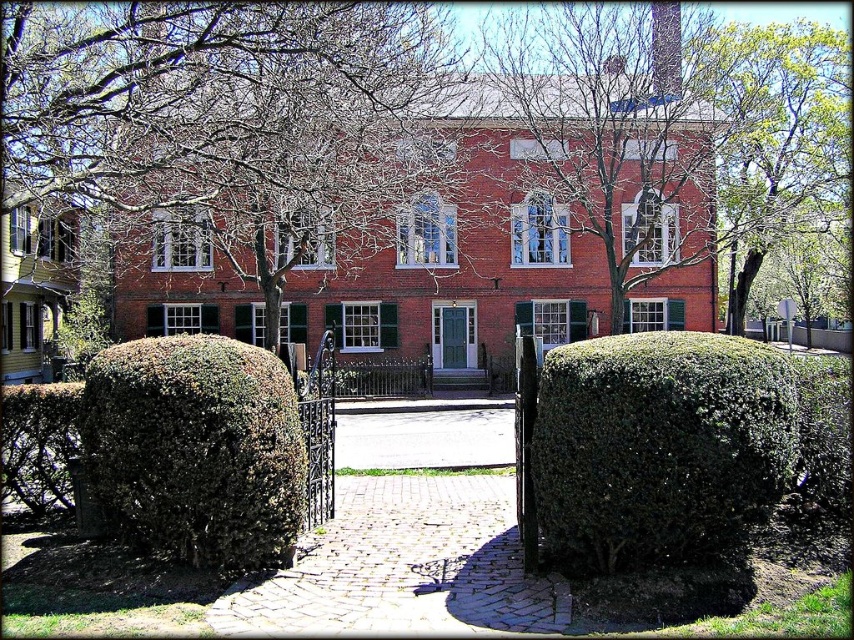
Can you confirm if green leafy hedge at center is positioned above green leafy bush at center?

Indeed, green leafy hedge at center is positioned over green leafy bush at center.

Is green leafy hedge at center wider than green leafy bush at center?

Yes, green leafy hedge at center is wider than green leafy bush at center.

Describe the element at coordinates (658, 445) in the screenshot. I see `green leafy hedge at center` at that location.

The width and height of the screenshot is (854, 640). Find the location of `green leafy hedge at center`. green leafy hedge at center is located at coordinates (658, 445).

Can you confirm if green leafy bush at center is positioned below green leafy hedge at lower left?

Actually, green leafy bush at center is above green leafy hedge at lower left.

Does green leafy bush at center have a smaller size compared to green leafy hedge at lower left?

No.

Is point (221, 392) positioned before point (57, 442)?

Yes, point (221, 392) is in front of point (57, 442).

Locate an element on the screen. The height and width of the screenshot is (640, 854). green leafy bush at center is located at coordinates (196, 449).

Between point (278, 212) and point (636, 381), which one is positioned behind?

The point (278, 212) is behind.

Between bare branches at center and green leafy hedge at center, which one appears on the right side from the viewer's perspective?

Positioned to the right is green leafy hedge at center.

Between point (37, 80) and point (755, 353), which one is positioned behind?

The point (37, 80) is more distant.

At what (x,y) coordinates should I click in order to perform the action: click on bare branches at center. Please return your answer as a coordinate pair (x, y). Looking at the image, I should click on (232, 115).